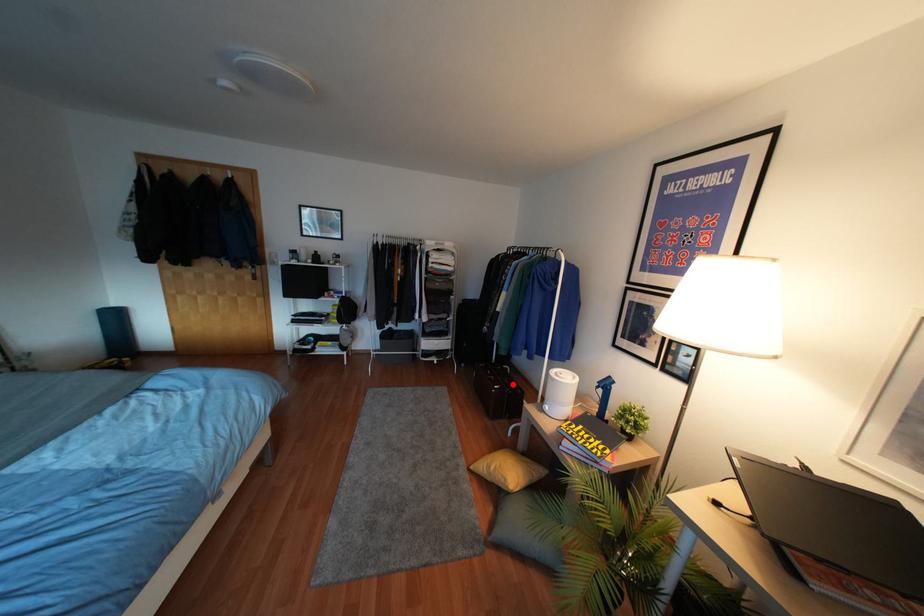
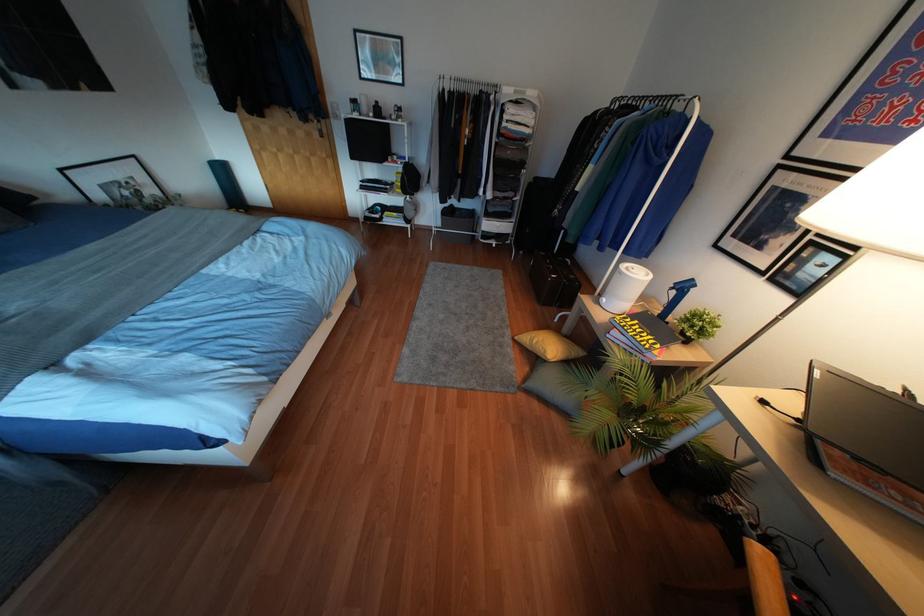
Question: I am providing you with two images of the same scene from different viewpoints. Given a red point in image1, look at the same physical point in image2. Is it:

Choices:
 (A) Closer to the viewpoint
 (B) Farther from the viewpoint

Answer: (A)